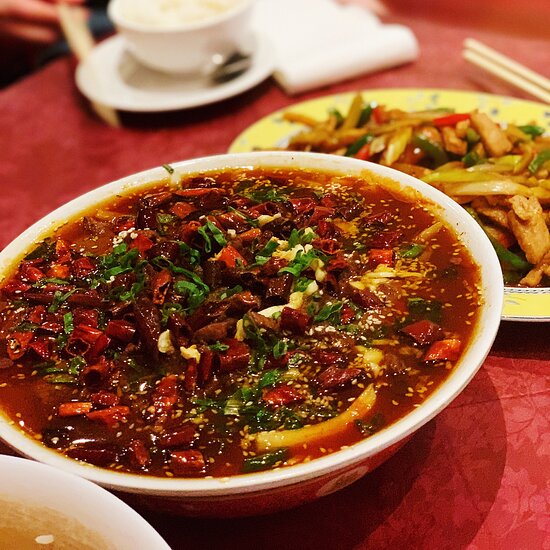
Find the location of a particular element. The image size is (550, 550). white coffee cup is located at coordinates (170, 42).